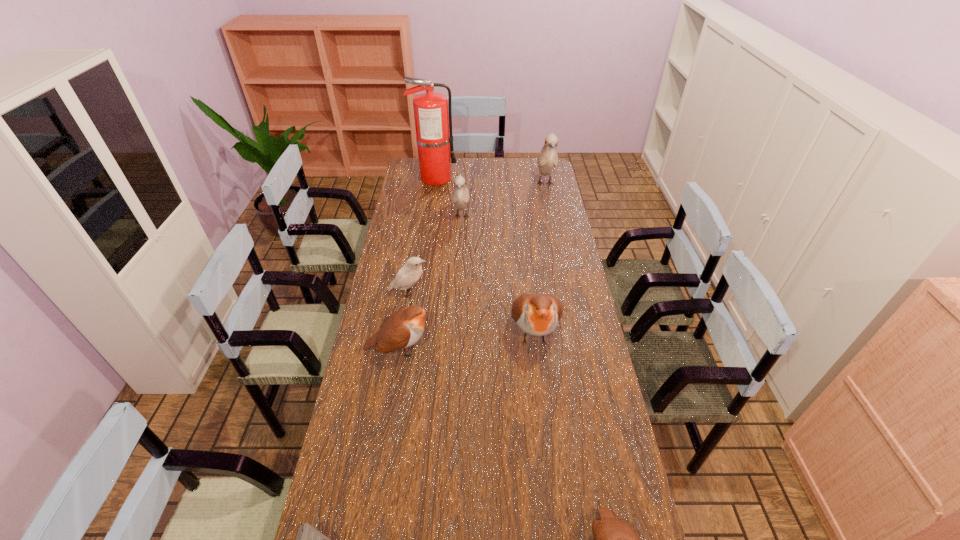
In order to click on free space located 0.110m at the nozzle of the red fire extinguisher in this screenshot , I will do `click(478, 178)`.

At what (x,y) coordinates should I click in order to perform the action: click on free spot located 0.090m at the beak of the farthest bird. Please return your answer as a coordinate pair (x, y). The height and width of the screenshot is (540, 960). Looking at the image, I should click on (550, 208).

The width and height of the screenshot is (960, 540). Identify the location of free location located at the face of the biggest brown bird. (550, 479).

Locate an element on the screen. vacant region located at the beak of the second smallest white bird is located at coordinates (460, 247).

The image size is (960, 540). I want to click on free location located 0.240m at the face of the leftmost brown bird, so click(505, 349).

Find the location of a particular element. The width and height of the screenshot is (960, 540). vacant space located at the beak of the nearest white bird is located at coordinates (448, 293).

Where is `fire extinguisher present at the far edge`? fire extinguisher present at the far edge is located at coordinates (432, 123).

This screenshot has height=540, width=960. I want to click on bird that is at the far edge, so click(547, 159).

Where is `fire extinguisher located in the left edge section of the desktop`? This screenshot has width=960, height=540. fire extinguisher located in the left edge section of the desktop is located at coordinates (432, 123).

Where is `object present at the far left corner`? The width and height of the screenshot is (960, 540). object present at the far left corner is located at coordinates (432, 123).